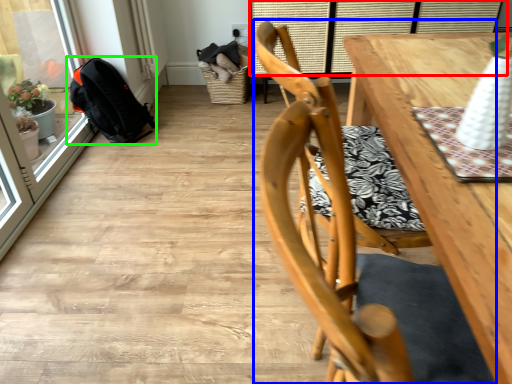
Question: Estimate the real-world distances between objects in this image. Which object is farther from window (highlighted by a red box), chair (highlighted by a blue box) or backpack (highlighted by a green box)?

Choices:
 (A) chair
 (B) backpack

Answer: (A)